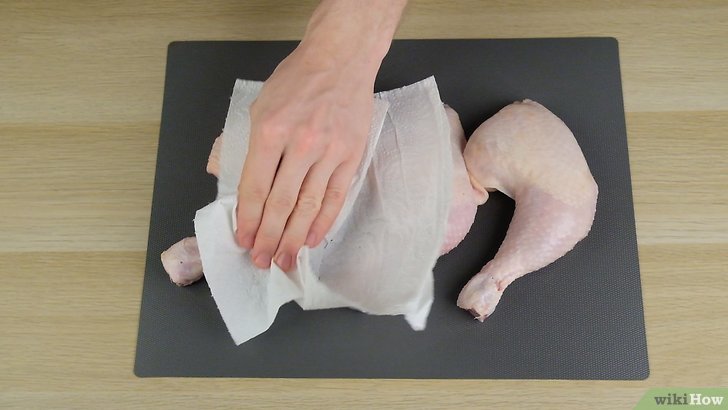
You are a GUI agent. You are given a task and a screenshot of the screen. Output one action in this format:
    pyautogui.click(x=<x>, y=<y>)
    Task: Click on the wood surface
    The width and height of the screenshot is (728, 410).
    Given the screenshot: What is the action you would take?
    pyautogui.click(x=678, y=209)